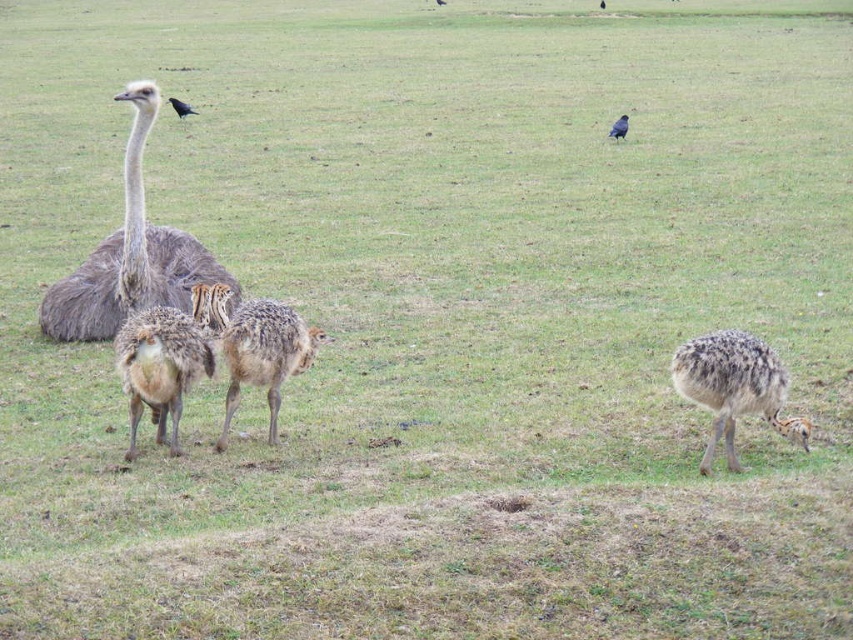
Can you confirm if speckled feathered ostrich at right is bigger than black feathered bird at upper left?

Indeed, speckled feathered ostrich at right has a larger size compared to black feathered bird at upper left.

What do you see at coordinates (734, 387) in the screenshot? The width and height of the screenshot is (853, 640). I see `speckled feathered ostrich at right` at bounding box center [734, 387].

Locate an element on the screen. Image resolution: width=853 pixels, height=640 pixels. speckled feathered ostrich at right is located at coordinates (734, 387).

Can you confirm if brown speckled feathers at center is positioned below speckled feathered ostrich at center?

Yes, brown speckled feathers at center is below speckled feathered ostrich at center.

Which is above, brown speckled feathers at center or speckled feathered ostrich at center?

speckled feathered ostrich at center is above.

Is point (142, 387) more distant than point (260, 314)?

No.

Where is `brown speckled feathers at center`? brown speckled feathers at center is located at coordinates (160, 369).

Who is shorter, gray feathered ostrich at left or speckled feathered ostrich at right?

Standing shorter between the two is speckled feathered ostrich at right.

Does gray feathered ostrich at left appear over speckled feathered ostrich at right?

Yes, gray feathered ostrich at left is above speckled feathered ostrich at right.

Measure the distance between point (99, 260) and camera.

Point (99, 260) and camera are 26.84 feet apart.

This screenshot has height=640, width=853. Find the location of `gray feathered ostrich at left`. gray feathered ostrich at left is located at coordinates (129, 256).